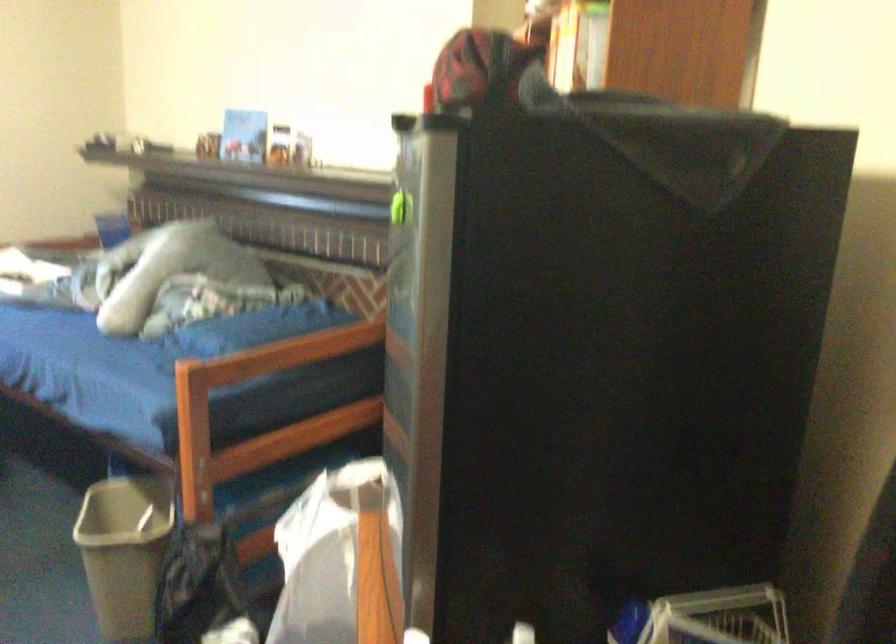
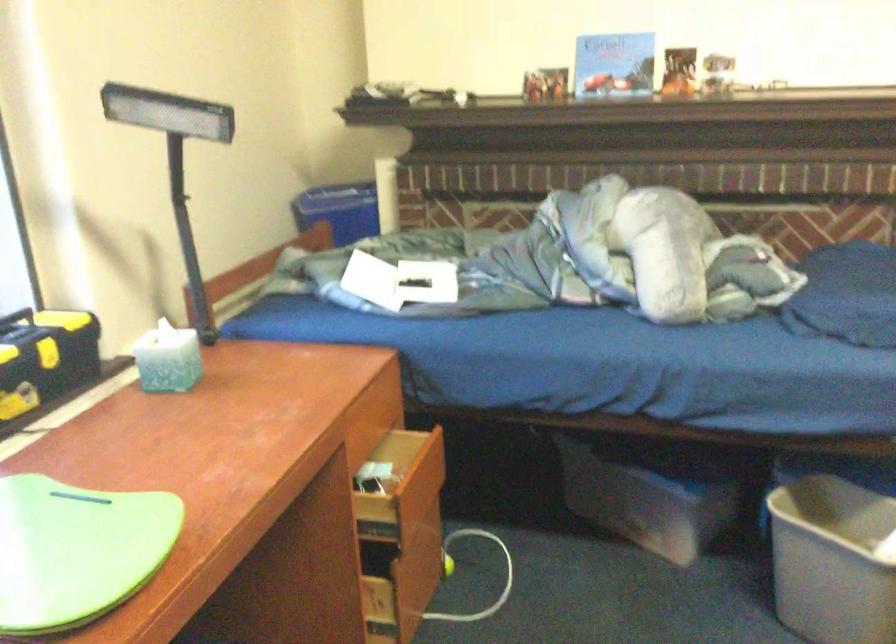
Question: In a continuous first-person perspective shot, in which direction is the camera moving?

Choices:
 (A) Left
 (B) Right
 (C) Forward
 (D) Backward

Answer: (A)